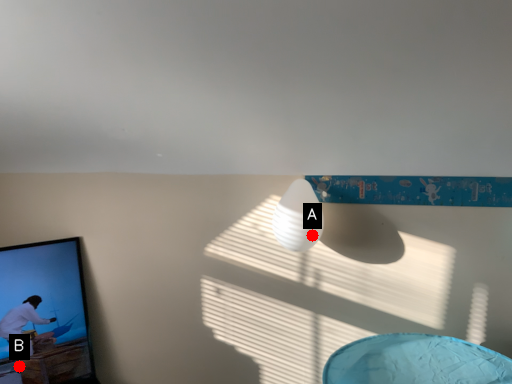
Question: Two points are circled on the image, labeled by A and B beside each circle. Among these points, which one is nearest to the camera?

Choices:
 (A) A is closer
 (B) B is closer

Answer: (A)